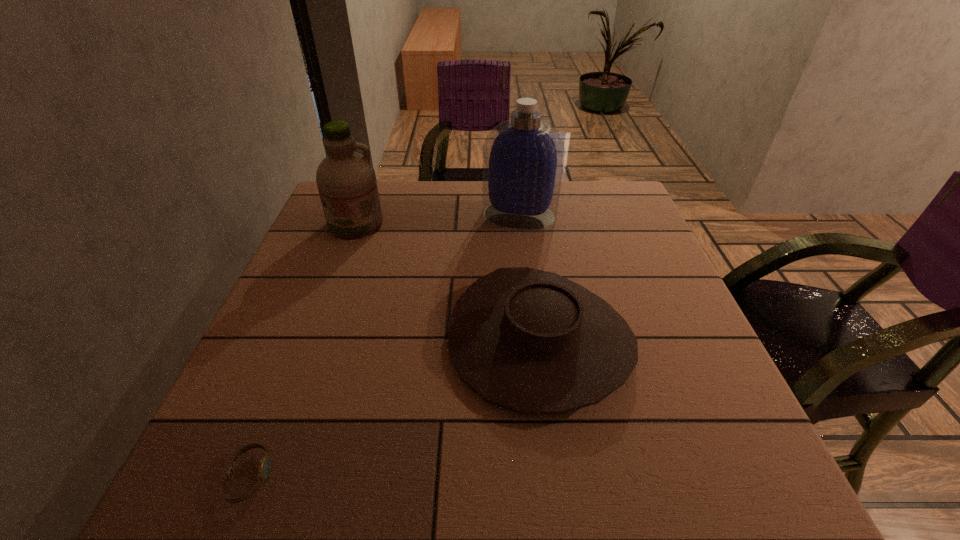
Locate an element on the screen. Image resolution: width=960 pixels, height=540 pixels. vacant space that satisfies the following two spatial constraints: 1. on the front label of the left cleansing agent; 2. on the face of the shortest object is located at coordinates (261, 477).

At what (x,y) coordinates should I click in order to perform the action: click on vacant region that satisfies the following two spatial constraints: 1. on the front label of the left cleansing agent; 2. on the face of the shortest object. Please return your answer as a coordinate pair (x, y). The width and height of the screenshot is (960, 540). Looking at the image, I should click on (261, 477).

Identify the location of vacant point that satisfies the following two spatial constraints: 1. on the front side of the cowboy hat; 2. on the face of the shortest object. The height and width of the screenshot is (540, 960). (558, 477).

You are a GUI agent. You are given a task and a screenshot of the screen. Output one action in this format:
    pyautogui.click(x=<x>, y=<y>)
    Task: Click on the vacant position in the image that satisfies the following two spatial constraints: 1. on the front label of the left cleansing agent; 2. on the right side of the third tallest object
    
    Given the screenshot: What is the action you would take?
    pyautogui.click(x=312, y=340)

The image size is (960, 540). I want to click on vacant region that satisfies the following two spatial constraints: 1. on the front label of the left cleansing agent; 2. on the face of the shortest object, so click(x=261, y=477).